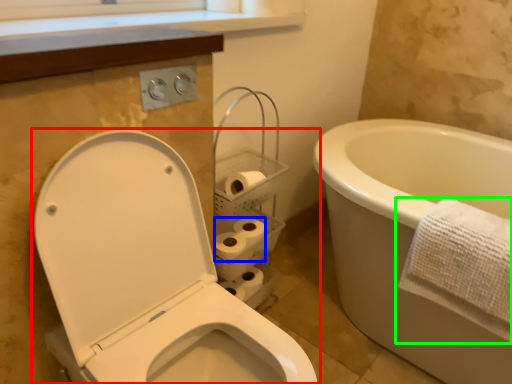
Question: Considering the real-world distances, which object is closest to toilet (highlighted by a red box)? toilet paper (highlighted by a blue box) or towel (highlighted by a green box).

Choices:
 (A) toilet paper
 (B) towel

Answer: (A)